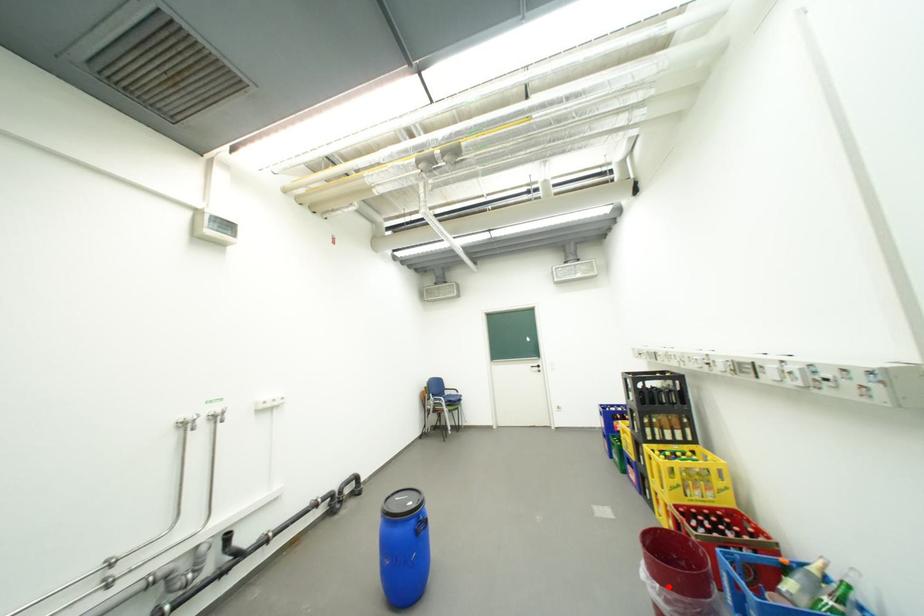
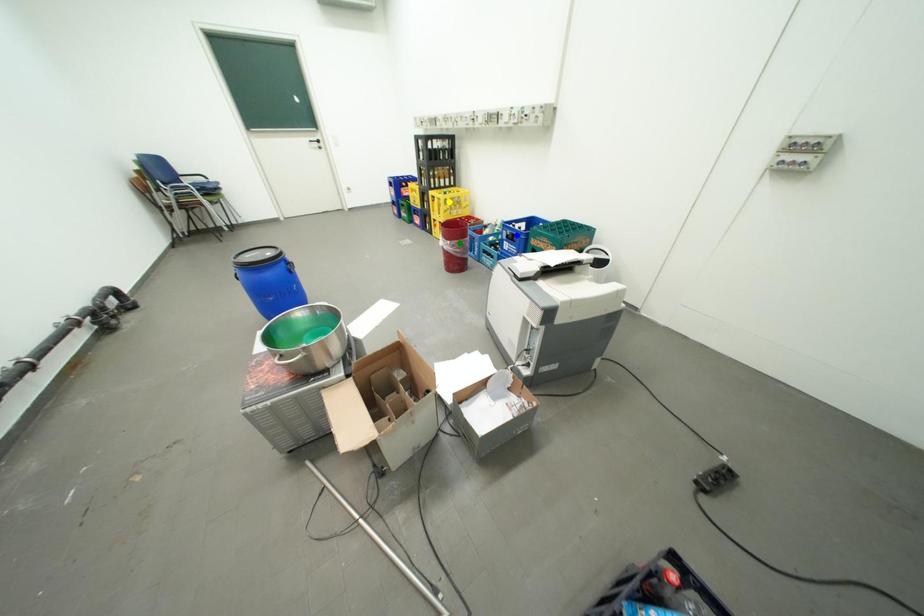
Question: I am providing you with two images of the same scene from different viewpoints. A red point is marked on the first image. You are given multiple points on the second image. Can you choose the point in image 2 that corresponds to the point in image 1?

Choices:
 (A) green point
 (B) blue point
 (C) yellow point

Answer: (A)